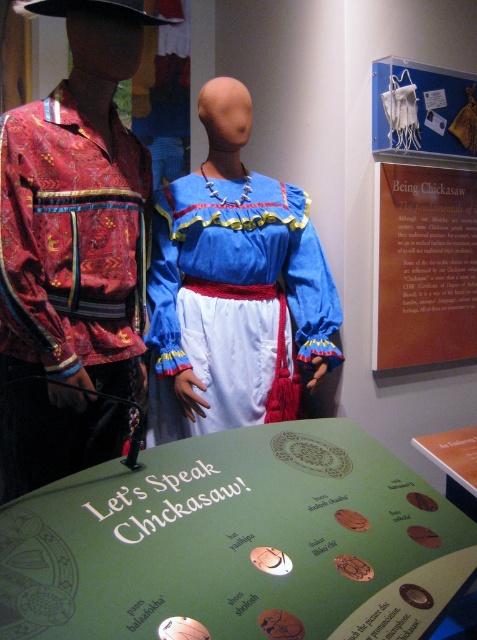
Is green cardboard sign at center shorter than matte blue fabric dress at center?

Correct, green cardboard sign at center is not as tall as matte blue fabric dress at center.

The width and height of the screenshot is (477, 640). What do you see at coordinates (237, 541) in the screenshot? I see `green cardboard sign at center` at bounding box center [237, 541].

You are a GUI agent. You are given a task and a screenshot of the screen. Output one action in this format:
    pyautogui.click(x=<x>, y=<y>)
    Task: Click on the green cardboard sign at center
    
    Given the screenshot: What is the action you would take?
    pyautogui.click(x=237, y=541)

Is green cardboard sign at center wider than matte red fabric shirt at left?

Correct, the width of green cardboard sign at center exceeds that of matte red fabric shirt at left.

Between green cardboard sign at center and matte red fabric shirt at left, which one is positioned higher?

matte red fabric shirt at left is higher up.

Between point (380, 468) and point (12, 124), which one is positioned behind?

Positioned behind is point (12, 124).

This screenshot has height=640, width=477. Find the location of `green cardboard sign at center`. green cardboard sign at center is located at coordinates (237, 541).

Does matte blue fabric dress at center appear under brown paper sign at upper center?

Yes, matte blue fabric dress at center is below brown paper sign at upper center.

Consider the image. Does matte blue fabric dress at center have a greater height compared to brown paper sign at upper center?

Yes.

Does point (209, 228) come behind point (414, 241)?

No, (209, 228) is in front of (414, 241).

You are a GUI agent. You are given a task and a screenshot of the screen. Output one action in this format:
    pyautogui.click(x=<x>, y=<y>)
    Task: Click on the matte blue fabric dress at center
    The height and width of the screenshot is (640, 477).
    Given the screenshot: What is the action you would take?
    pyautogui.click(x=234, y=289)